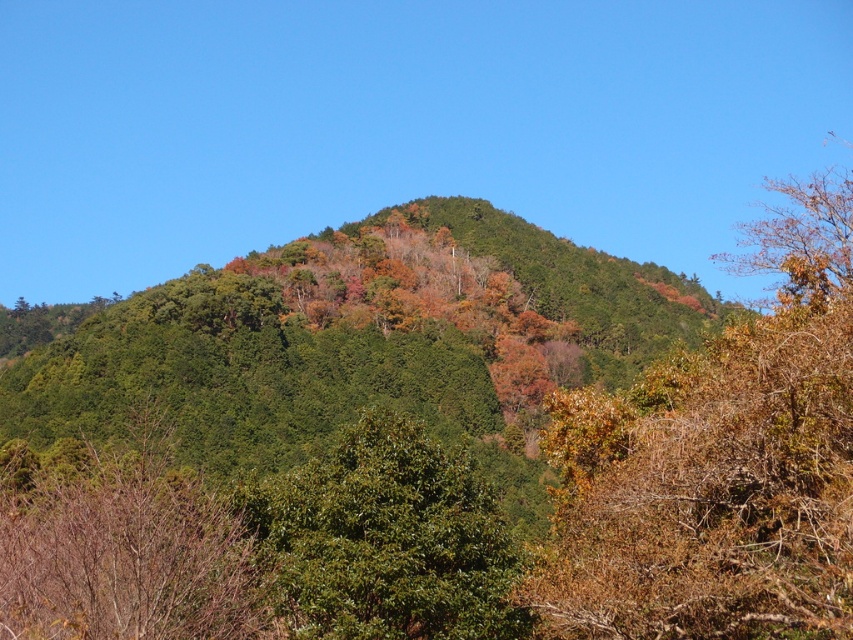
You are standing in the mountain landscape and want to walk from the brown leafy bush at right to the green matte tree at center. Which direction should you move to reach the tree?

The brown leafy bush at right is positioned on the right side of the green matte tree at center. To reach the tree, you should move to the left from the bush.

You are standing at the base of the mountain and looking up. You see a green matte tree at center and a green glossy bush at center. Which object is closer to you?

The green matte tree at center is closer to you because it is located below the green glossy bush at center, meaning it is positioned lower in the visual field, which typically indicates proximity in such landscapes.